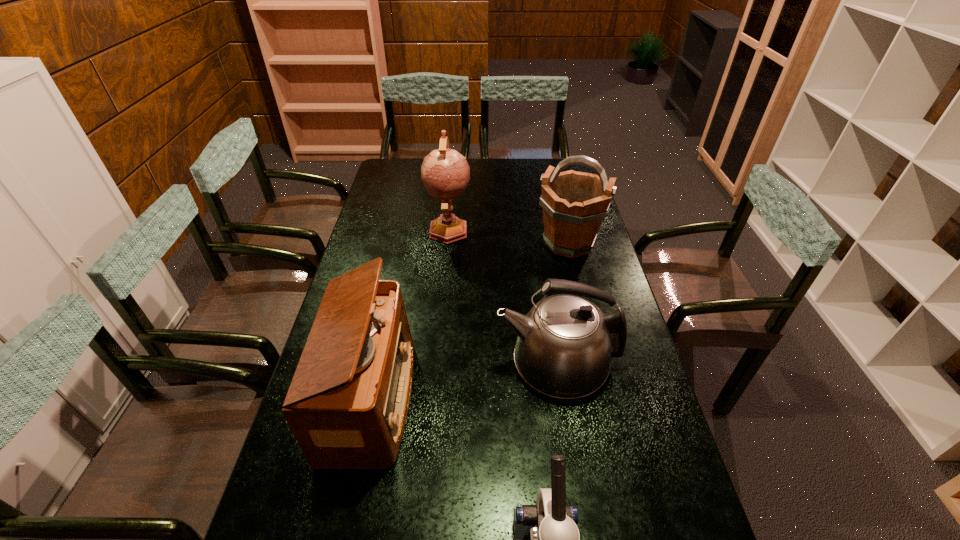
Locate an element on the screen. The width and height of the screenshot is (960, 540). globe is located at coordinates 445,173.

Where is `bucket`? Image resolution: width=960 pixels, height=540 pixels. bucket is located at coordinates coord(574,204).

Locate an element on the screen. radio receiver is located at coordinates (347, 404).

Find the location of `kettle`. kettle is located at coordinates (565, 343).

You are a GUI agent. You are given a task and a screenshot of the screen. Output one action in this format:
    pyautogui.click(x=<x>, y=<y>)
    Task: Click on the free space located 0.150m on the front-facing side of the globe
    
    Given the screenshot: What is the action you would take?
    pyautogui.click(x=444, y=274)

Where is `vacant region located 0.120m on the back of the bucket`? vacant region located 0.120m on the back of the bucket is located at coordinates [x=560, y=207].

Where is `vacant space situated 0.100m on the front panel of the radio receiver`? vacant space situated 0.100m on the front panel of the radio receiver is located at coordinates point(448,398).

Where is `free space located 0.300m on the spout of the kettle`? The height and width of the screenshot is (540, 960). free space located 0.300m on the spout of the kettle is located at coordinates (391, 362).

Locate an element on the screen. vacant space situated on the spout of the kettle is located at coordinates pyautogui.click(x=373, y=362).

Locate an element on the screen. The height and width of the screenshot is (540, 960). vacant point located on the spout of the kettle is located at coordinates (419, 362).